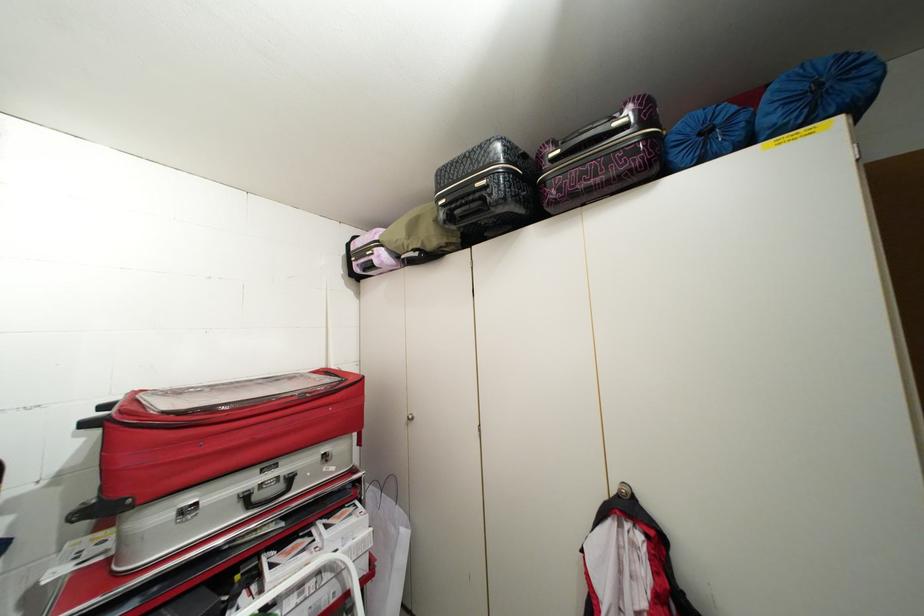
What are the coordinates of `silver suitcase handle` in the screenshot? It's located at (268, 491).